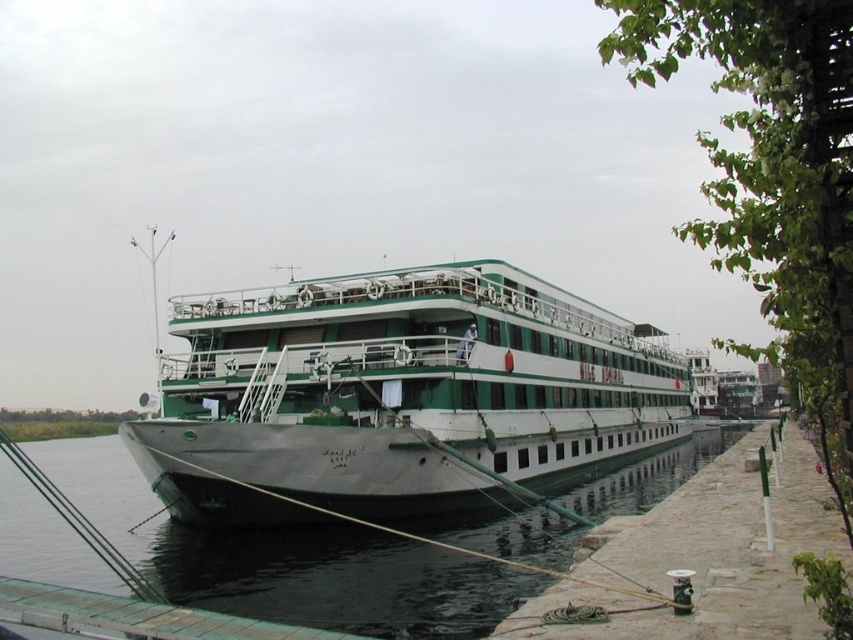
Question: Does green matte ship at center come in front of black rubber water at lower left?

Choices:
 (A) no
 (B) yes

Answer: (A)

Question: Can you confirm if green matte ship at center is positioned to the right of black rubber water at lower left?

Choices:
 (A) no
 (B) yes

Answer: (B)

Question: Can you confirm if green matte ship at center is positioned to the left of black rubber water at lower left?

Choices:
 (A) yes
 (B) no

Answer: (B)